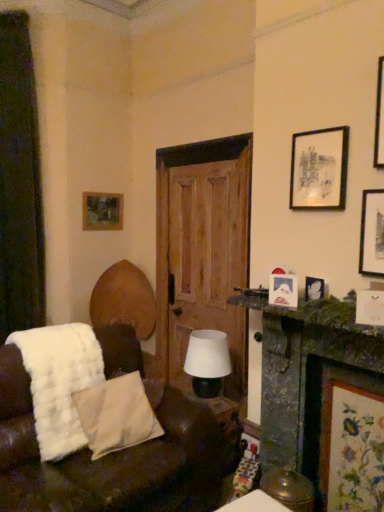
Question: Is white fluffy blanket at lower left surrounding matte white picture frame at right, positioned as the 3th picture frame in back-to-front order?

Choices:
 (A) no
 (B) yes

Answer: (A)

Question: Can you confirm if white fluffy blanket at lower left is positioned to the right of matte white picture frame at right, placed as the 2th picture frame when sorted from left to right?

Choices:
 (A) yes
 (B) no

Answer: (B)

Question: From the image's perspective, is white fluffy blanket at lower left above matte white picture frame at right, the third picture frame positioned from the top?

Choices:
 (A) yes
 (B) no

Answer: (B)

Question: Is white fluffy blanket at lower left further to the viewer compared to matte white picture frame at right, arranged as the 4th picture frame when viewed from the right?

Choices:
 (A) no
 (B) yes

Answer: (A)

Question: Is white fluffy blanket at lower left oriented towards matte white picture frame at right, the 3th picture frame positioned from the front?

Choices:
 (A) yes
 (B) no

Answer: (B)

Question: Is white fluffy blanket at lower left bigger than matte white picture frame at right, the 3th picture frame ordered from the bottom?

Choices:
 (A) yes
 (B) no

Answer: (A)

Question: From the image's perspective, would you say matte white picture frame at right, the third picture frame positioned from the top, is shown under green mossy stone mantelpiece at right?

Choices:
 (A) no
 (B) yes

Answer: (A)

Question: Considering the relative positions of matte white picture frame at right, positioned as the 3th picture frame in back-to-front order, and green mossy stone mantelpiece at right in the image provided, is matte white picture frame at right, positioned as the 3th picture frame in back-to-front order, to the left of green mossy stone mantelpiece at right from the viewer's perspective?

Choices:
 (A) no
 (B) yes

Answer: (B)

Question: Does matte white picture frame at right, the 3th picture frame positioned from the front, have a lesser width compared to green mossy stone mantelpiece at right?

Choices:
 (A) yes
 (B) no

Answer: (A)

Question: Considering the relative positions of matte white picture frame at right, the 3th picture frame ordered from the bottom, and green mossy stone mantelpiece at right in the image provided, is matte white picture frame at right, the 3th picture frame ordered from the bottom, behind green mossy stone mantelpiece at right?

Choices:
 (A) yes
 (B) no

Answer: (A)

Question: Can you confirm if matte white picture frame at right, placed as the 2th picture frame when sorted from left to right, is taller than green mossy stone mantelpiece at right?

Choices:
 (A) yes
 (B) no

Answer: (A)

Question: Is matte white picture frame at right, positioned as the 3th picture frame in back-to-front order, in front of green mossy stone mantelpiece at right?

Choices:
 (A) yes
 (B) no

Answer: (B)

Question: Considering the relative sizes of white fluffy blanket at lower left and white matte table lamp at center in the image provided, is white fluffy blanket at lower left shorter than white matte table lamp at center?

Choices:
 (A) no
 (B) yes

Answer: (A)